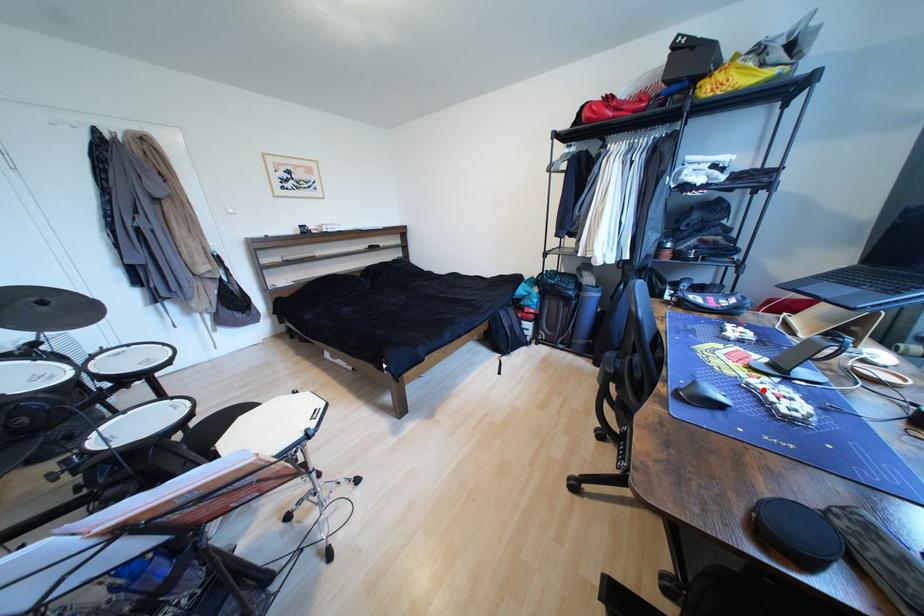
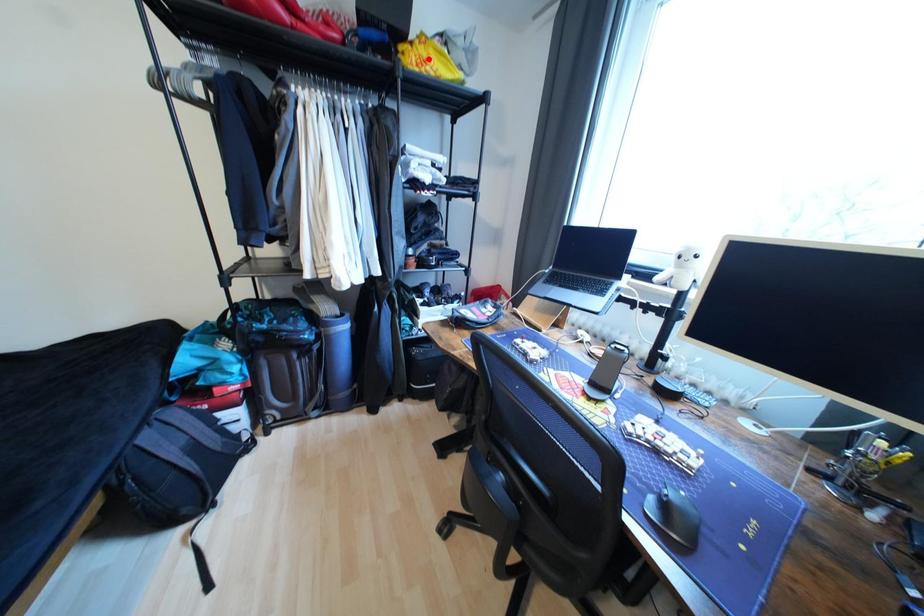
I am providing you with two images of the same scene from different viewpoints. A red point is marked on the first image and another point is marked on the second image. Do the highlighted points in image1 and image2 indicate the same real-world spot?

No